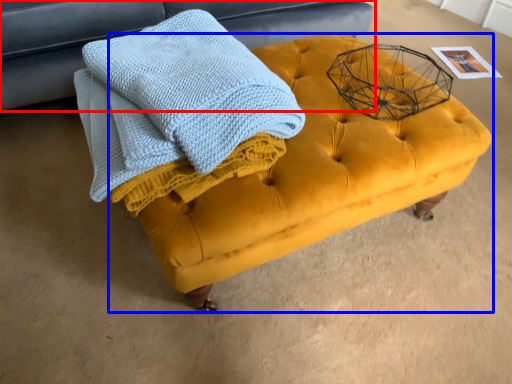
Question: Which object appears farthest to the camera in this image, furniture (highlighted by a red box) or table (highlighted by a blue box)?

Choices:
 (A) furniture
 (B) table

Answer: (A)